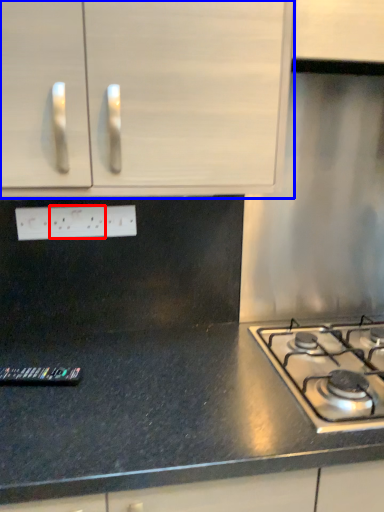
Question: Which object appears farthest to the camera in this image, electric outlet (highlighted by a red box) or cabinetry (highlighted by a blue box)?

Choices:
 (A) electric outlet
 (B) cabinetry

Answer: (A)